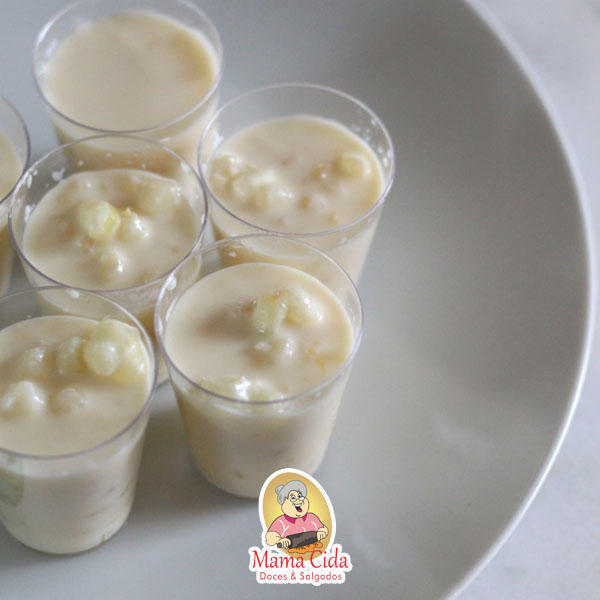
This screenshot has height=600, width=600. I want to click on cups, so click(x=338, y=105), click(x=323, y=267).